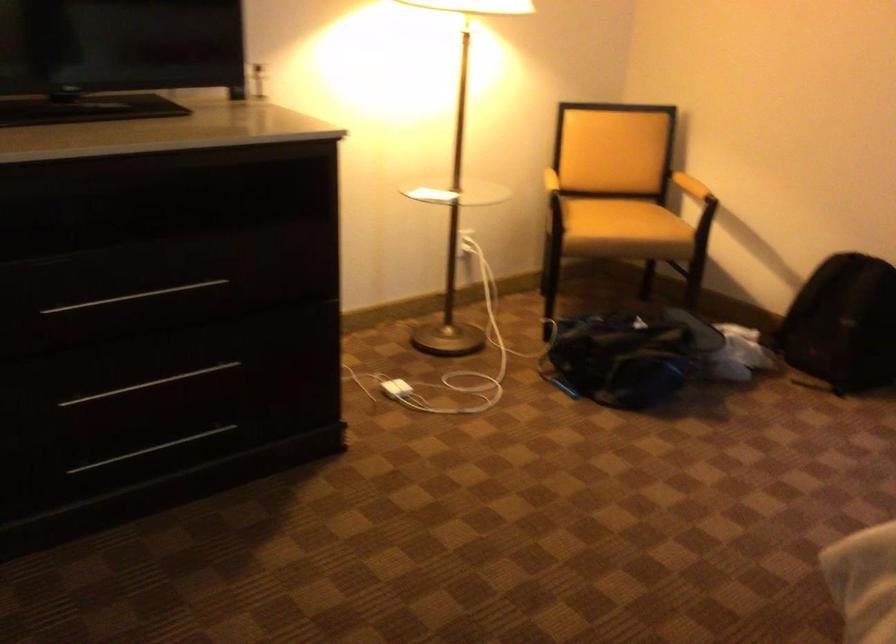
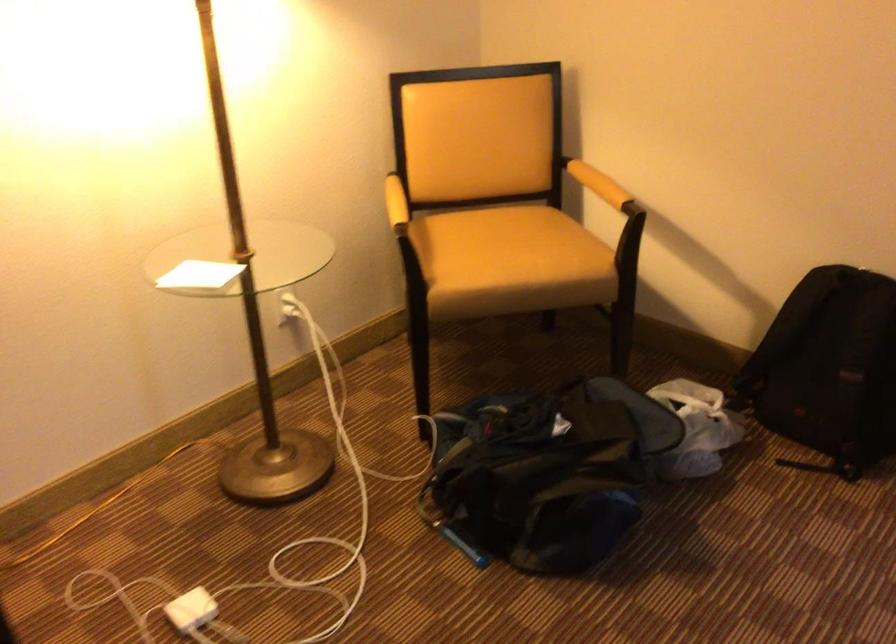
Where in the second image is the point corresponding to (x=389, y=395) from the first image?

(192, 609)